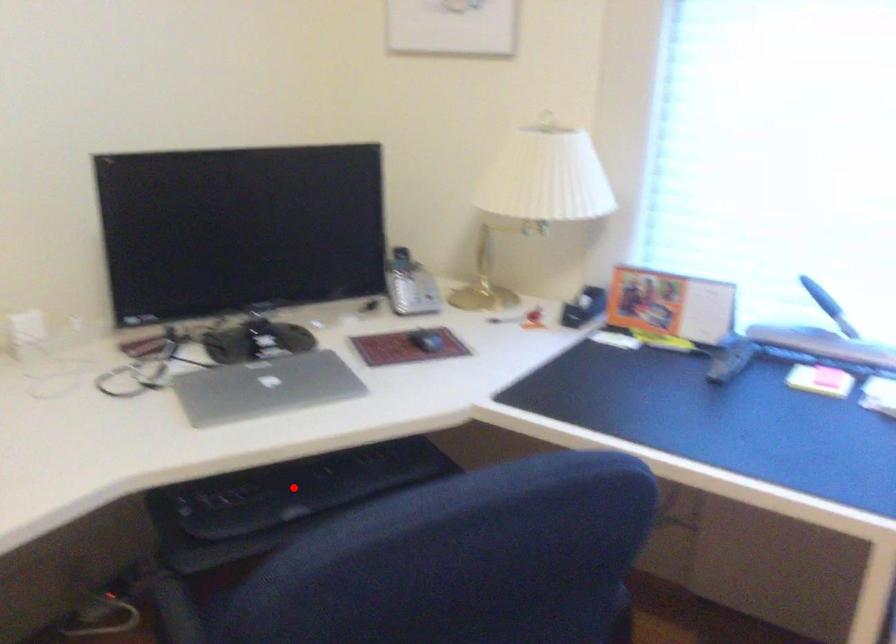
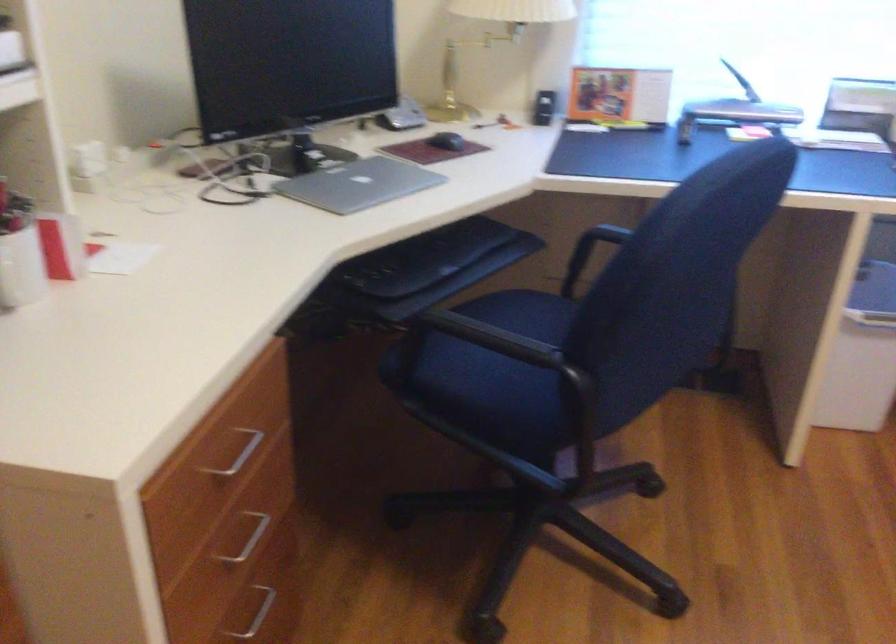
Locate, in the second image, the point that corresponds to the highlighted location in the first image.

(425, 258)